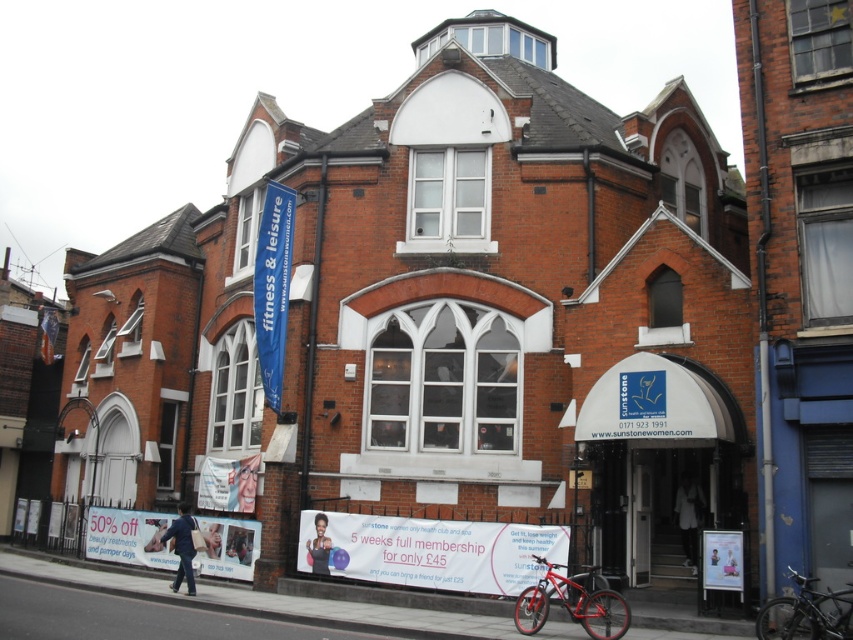
You are planning to install a new sign on the brick building. The sign you have is the same size as the shiny black bicycle at lower right. Based on the scene, will this new sign be smaller than the white glossy banner at lower center?

The white glossy banner at lower center is larger in size than the shiny black bicycle at lower right, so yes, the new sign will be smaller than the white glossy banner at lower center.

You are standing in front of the brick building and want to read the white paper sign at lower left and the shiny black bicycle at lower right. Which object is closer to the left side of the building?

The white paper sign at lower left is closer to the left side of the building because it is positioned to the left of the shiny black bicycle at lower right.